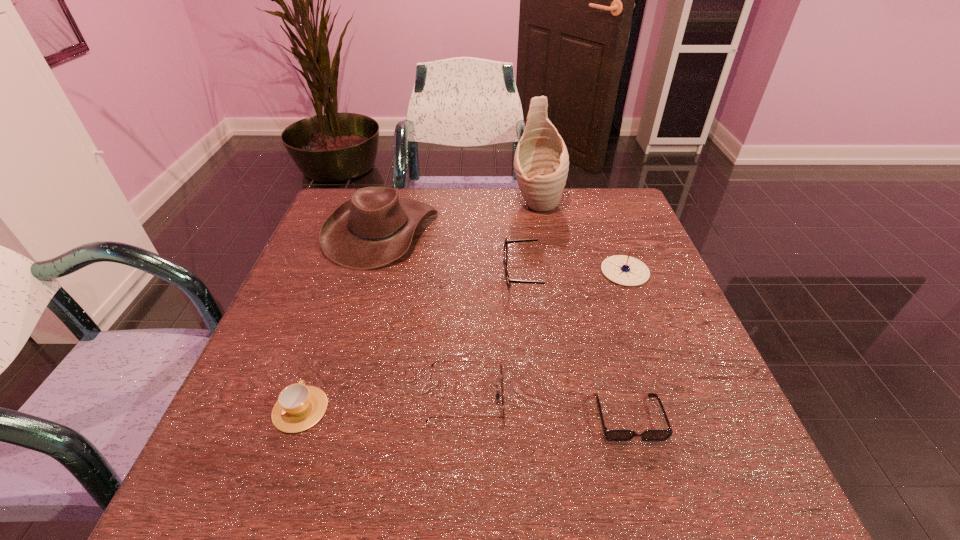
The height and width of the screenshot is (540, 960). In order to click on cowboy hat that is at the left edge in this screenshot , I will do `click(373, 228)`.

The width and height of the screenshot is (960, 540). Find the location of `cup that is at the left edge`. cup that is at the left edge is located at coordinates (299, 407).

Where is `compass at the right edge`? The image size is (960, 540). compass at the right edge is located at coordinates (621, 269).

This screenshot has width=960, height=540. I want to click on sunglasses positioned at the right edge, so click(x=612, y=435).

You are a GUI agent. You are given a task and a screenshot of the screen. Output one action in this format:
    pyautogui.click(x=<x>, y=<y>)
    Task: Click on the object that is at the far left corner
    The height and width of the screenshot is (540, 960).
    Given the screenshot: What is the action you would take?
    pyautogui.click(x=373, y=228)

The width and height of the screenshot is (960, 540). I want to click on free point at the far edge, so click(x=426, y=196).

Locate an element on the screen. The image size is (960, 540). vacant space at the near edge is located at coordinates [x=521, y=496].

In the image, there is a desktop. Where is `vacant region at the left edge`? This screenshot has height=540, width=960. vacant region at the left edge is located at coordinates (328, 274).

Find the location of a particular element. The image size is (960, 540). vacant space at the right edge of the desktop is located at coordinates (650, 416).

Locate an element on the screen. free area in between the spectacles and the second tallest object is located at coordinates (451, 253).